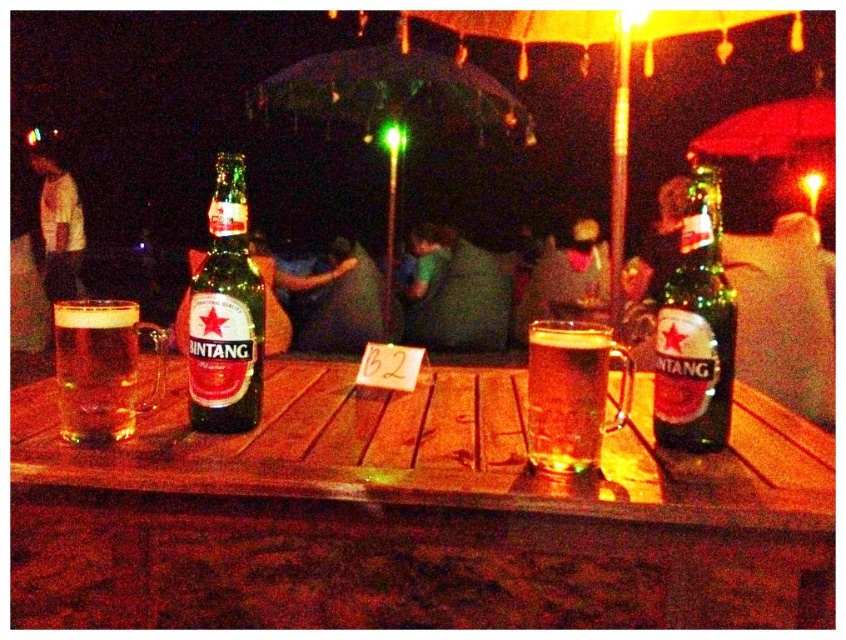
You are a waiter at this bar and need to place a new drink order on the table. The drink order has a width of 20 cm. Considering the orange fabric umbrella at upper center and the green fabric shirt at center, which object is wider and can accommodate the drink order without overlapping?

The orange fabric umbrella at upper center is wider than the green fabric shirt at center. Since the drink order is 20 cm wide, you should place it on the orange fabric umbrella at upper center as it has sufficient width to accommodate the drink without overlapping.

You are a waiter at the bar and need to place a new drink order on the table. The drink requires a space larger than the green fabric shirt at center. Is there enough space on the table near the orange fabric umbrella at upper center?

The orange fabric umbrella at upper center is larger in size than the green fabric shirt at center, so there is sufficient space near the orange fabric umbrella at upper center to place the drink order as required.